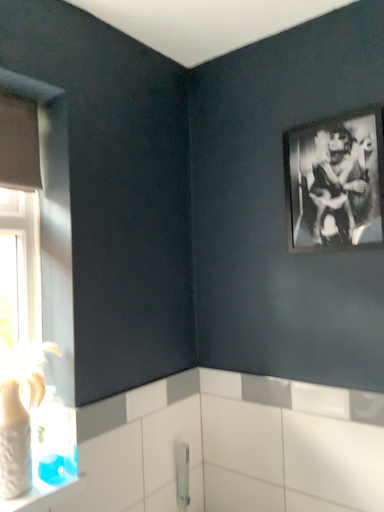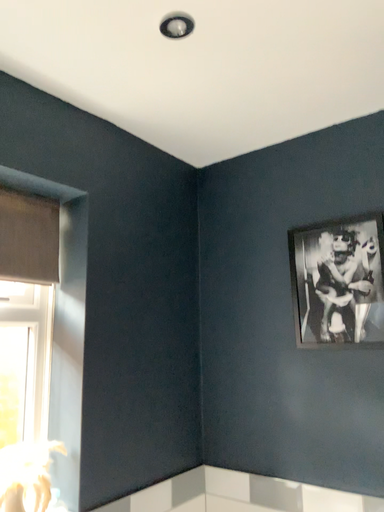
Question: Which way did the camera rotate in the video?

Choices:
 (A) rotated downward
 (B) rotated upward

Answer: (B)